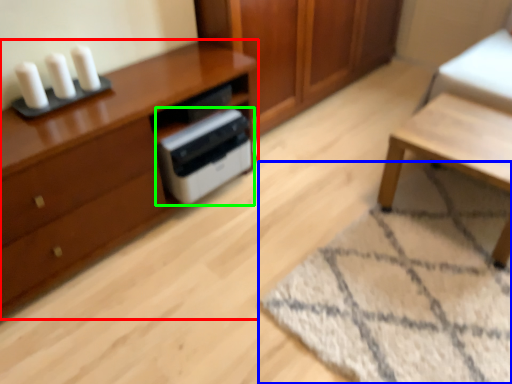
Question: Which is nearer to the chest of drawers (highlighted by a red box)? mat (highlighted by a blue box) or home appliance (highlighted by a green box).

Choices:
 (A) mat
 (B) home appliance

Answer: (B)